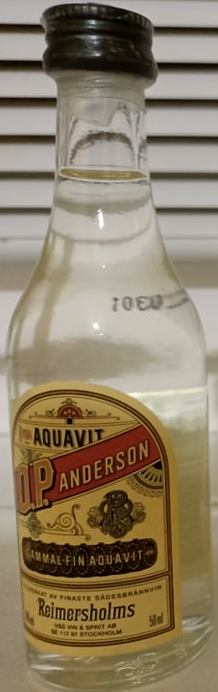
The height and width of the screenshot is (692, 218). In order to click on glass bottle in this screenshot , I will do `click(189, 365)`.